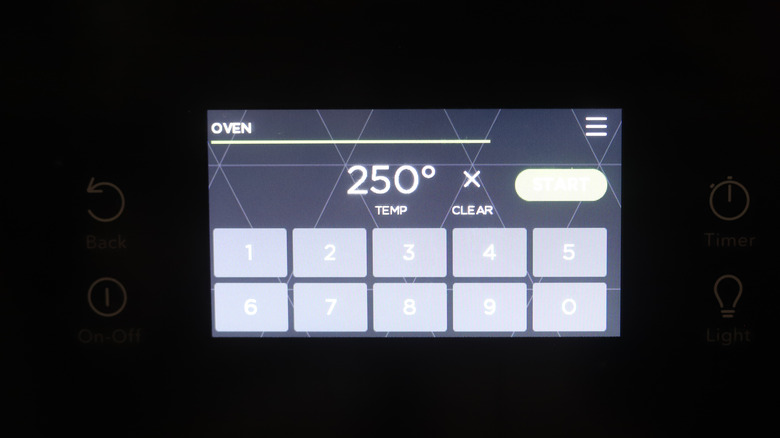
Identify the location of text "oven". (238, 130).